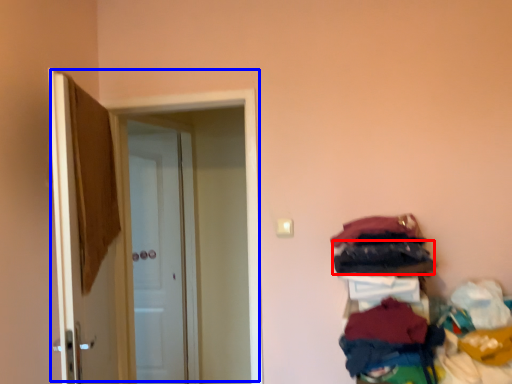
Question: Which object is further to the camera taking this photo, clothing (highlighted by a red box) or door (highlighted by a blue box)?

Choices:
 (A) clothing
 (B) door

Answer: (B)